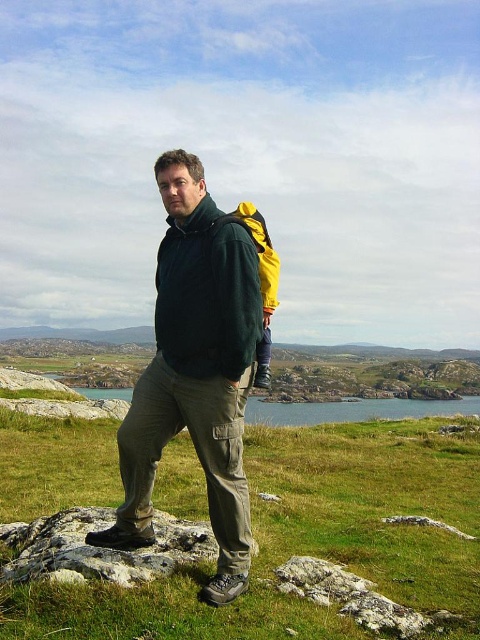
Is green matte grass at center positioned in front of gray rock at lower center?

Yes, green matte grass at center is closer to the viewer.

The width and height of the screenshot is (480, 640). What are the coordinates of `green matte grass at center` in the screenshot? It's located at (309, 540).

Is point (315, 477) behind point (83, 540)?

Yes, point (315, 477) is farther from viewer.

Where is `green matte grass at center`? green matte grass at center is located at coordinates (309, 540).

Which of these two, green matte grass at center or matte green jacket at center, stands shorter?

With less height is green matte grass at center.

Is green matte grass at center in front of matte green jacket at center?

Yes, green matte grass at center is closer to the viewer.

Measure the distance between point [407,419] and camera.

Point [407,419] and camera are 115.84 feet apart from each other.

In order to click on green matte grass at center in this screenshot , I will do `click(309, 540)`.

Does green matte grass at center have a greater height compared to green water at center?

No, green matte grass at center is not taller than green water at center.

Does green matte grass at center appear over green water at center?

Indeed, green matte grass at center is positioned over green water at center.

Between point (28, 481) and point (295, 420), which one is positioned behind?

The point (295, 420) is more distant.

This screenshot has height=640, width=480. I want to click on green matte grass at center, so (309, 540).